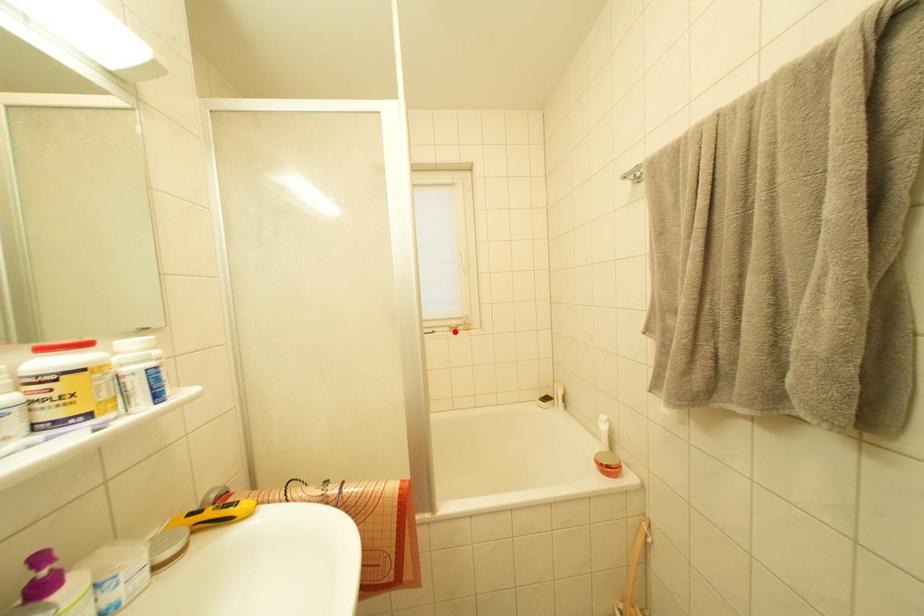
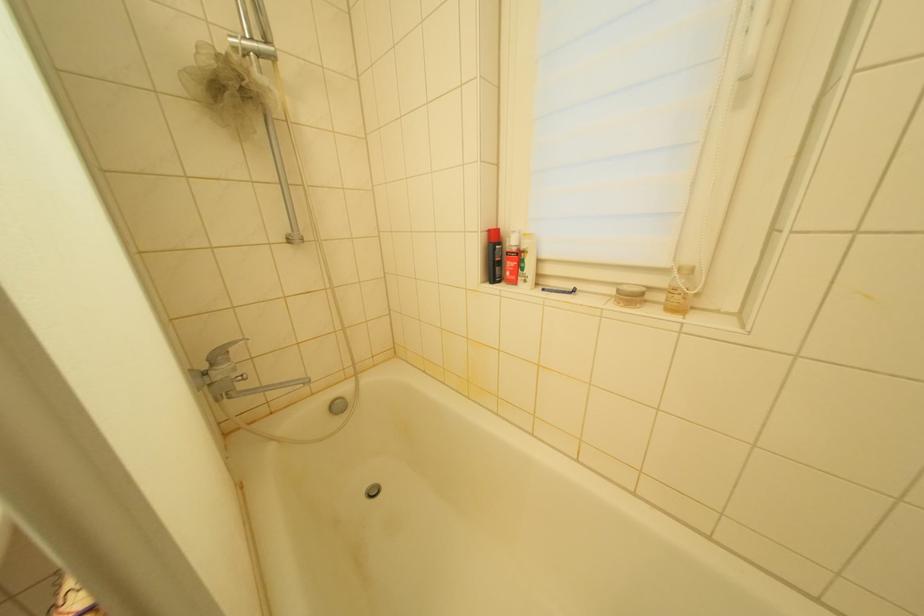
Question: I am providing you with two images of the same scene from different viewpoints. A red point is marked on the first image. Can you still see the location of the red point in image 2?

Choices:
 (A) Yes
 (B) No

Answer: (A)